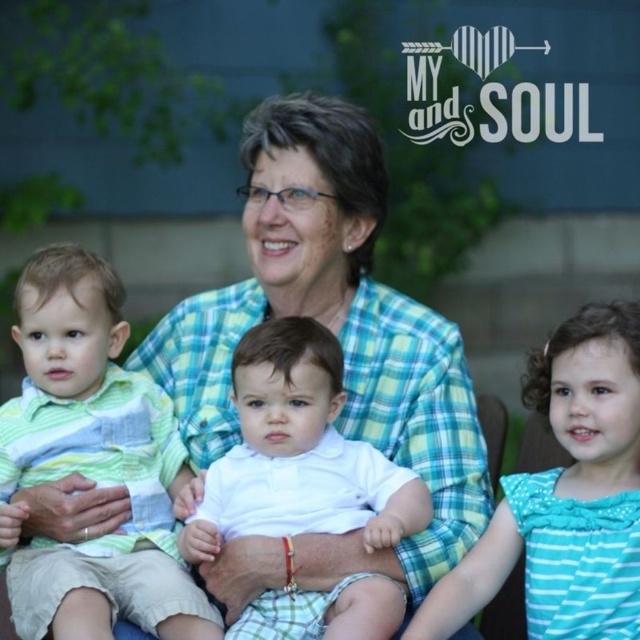
Question: Which point appears closest to the camera in this image?

Choices:
 (A) (x=368, y=557)
 (B) (x=104, y=620)
 (C) (x=621, y=360)

Answer: (B)

Question: Does green plaid shirt at center appear on the left side of white cotton shirt at center?

Choices:
 (A) no
 (B) yes

Answer: (B)

Question: Which of these objects is positioned closest to the green striped shirt at left?

Choices:
 (A) green plaid shirt at center
 (B) white cotton shirt at right
 (C) white cotton shirt at center

Answer: (C)

Question: Is green striped shirt at left bigger than white cotton shirt at center?

Choices:
 (A) no
 (B) yes

Answer: (B)

Question: Estimate the real-world distances between objects in this image. Which object is farther from the green striped shirt at left?

Choices:
 (A) white cotton shirt at right
 (B) white cotton shirt at center
 (C) green plaid shirt at center

Answer: (A)

Question: Is green plaid shirt at center above green striped shirt at left?

Choices:
 (A) no
 (B) yes

Answer: (B)